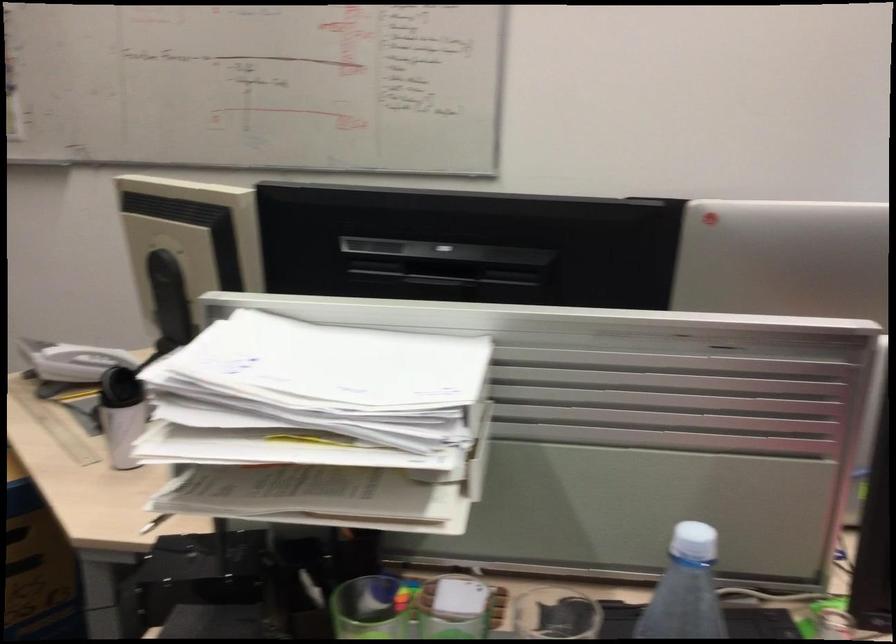
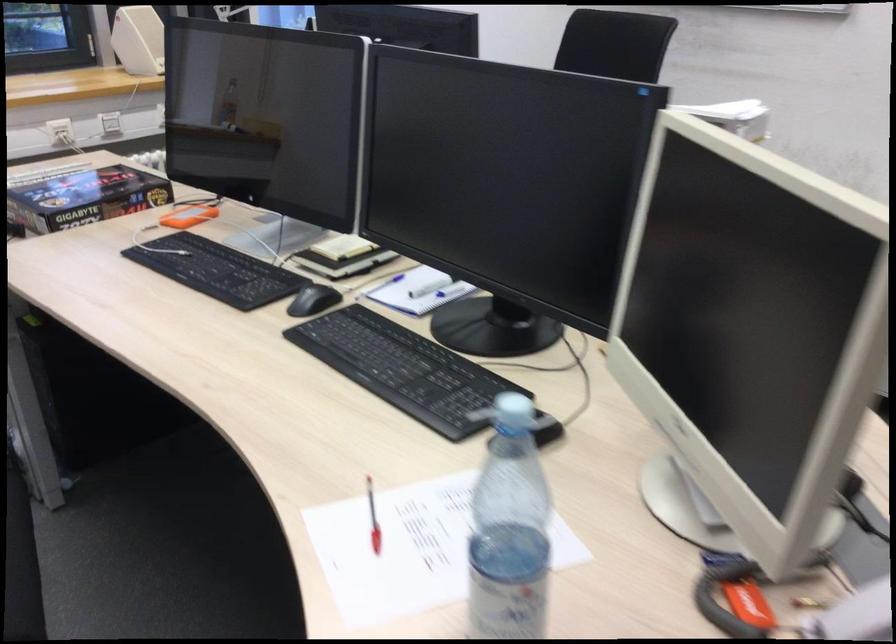
Question: I am providing you with two images of the same scene from different viewpoints. Please identify which objects are invisible in image2.

Choices:
 (A) white pet bowl
 (B) blue bottle cap
 (C) green pen holder
 (D) black product box

Answer: (C)